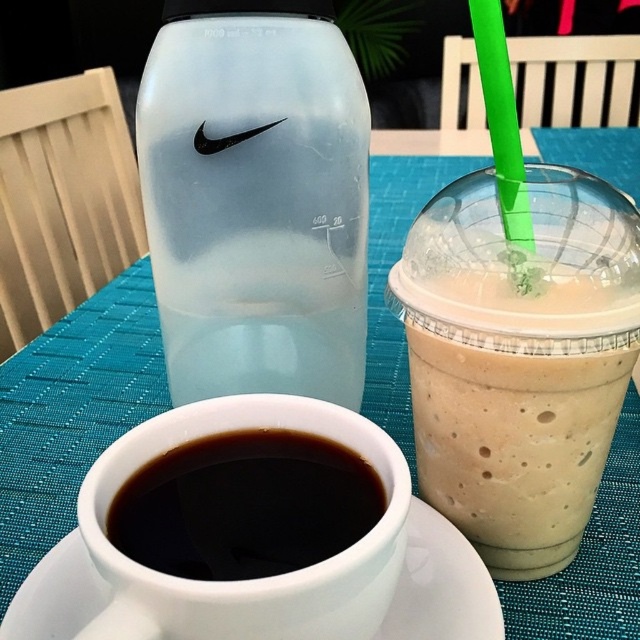
Please describe the location of the frosted glass bottle at center in the image using coordinates.

The frosted glass bottle at center is located at coordinates point (257, 205).

You are a bartender preparing drinks for a customer. You have a frosted glass bottle at center and a milkshake plastic cup at right. Which of these two items can hold more liquid?

The frosted glass bottle at center can hold more liquid because it is larger in size than the milkshake plastic cup at right.